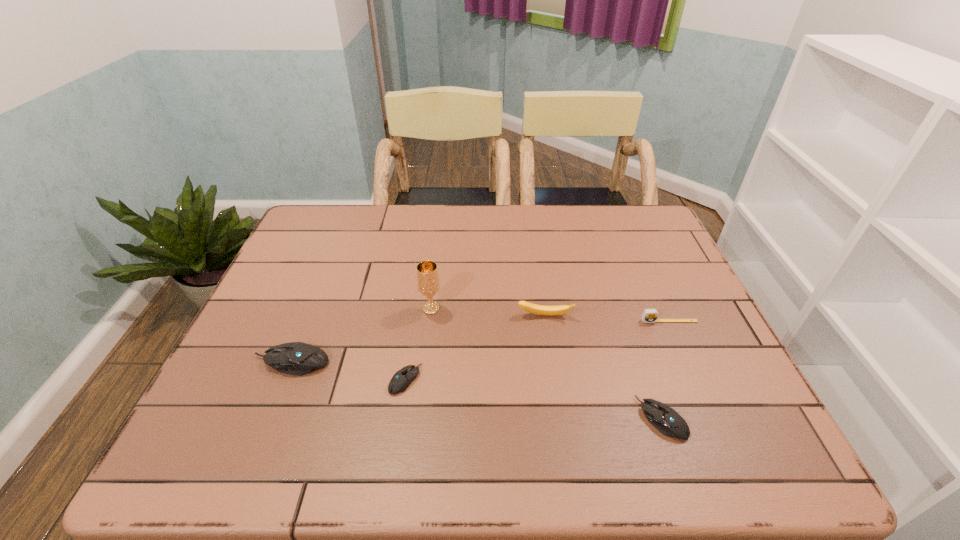
The height and width of the screenshot is (540, 960). Find the location of `unoccupied position between the banana and the second shortest object`. unoccupied position between the banana and the second shortest object is located at coordinates (603, 367).

Where is `vacant space that is in between the leftmost computer mouse and the banana`? The image size is (960, 540). vacant space that is in between the leftmost computer mouse and the banana is located at coordinates (418, 339).

Identify the location of free spot between the tallest object and the third object from right to left. (488, 312).

This screenshot has width=960, height=540. I want to click on free space between the nearest computer mouse and the leftmost object, so tap(476, 390).

Identify the location of unoccupied position between the chalice and the rightmost computer mouse. (546, 363).

Find the location of a particular element. free spot between the fourth object from left to right and the tallest computer mouse is located at coordinates (418, 339).

Locate an element on the screen. The image size is (960, 540). free area in between the tape measure and the rightmost computer mouse is located at coordinates (665, 370).

Identify which object is the fifth closest to the tape measure. Please provide its 2D coordinates. Your answer should be formatted as a tuple, i.e. [(x, y)], where the tuple contains the x and y coordinates of a point satisfying the conditions above.

[(296, 358)]

Select which object appears as the third closest to the tallest computer mouse. Please provide its 2D coordinates. Your answer should be formatted as a tuple, i.e. [(x, y)], where the tuple contains the x and y coordinates of a point satisfying the conditions above.

[(532, 308)]

Identify which computer mouse is the second closest to the shortest computer mouse. Please provide its 2D coordinates. Your answer should be formatted as a tuple, i.e. [(x, y)], where the tuple contains the x and y coordinates of a point satisfying the conditions above.

[(665, 419)]